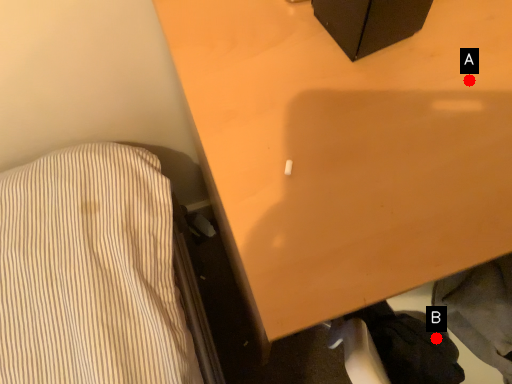
Question: Two points are circled on the image, labeled by A and B beside each circle. Which point is closer to the camera taking this photo?

Choices:
 (A) A is closer
 (B) B is closer

Answer: (A)